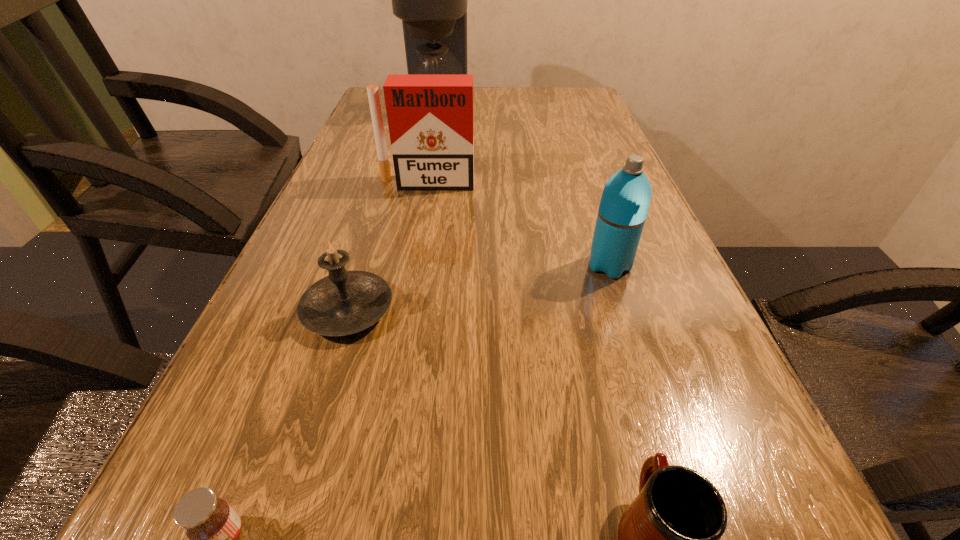
In order to click on coffee maker positioned at the left edge in this screenshot , I will do `click(431, 0)`.

What are the coordinates of `cigarette case located at the left edge` in the screenshot? It's located at (430, 116).

Identify the location of candle at the left edge. This screenshot has width=960, height=540. (345, 302).

In order to click on object located at the right edge in this screenshot , I will do `click(626, 197)`.

Identify the location of object that is at the far left corner. (431, 0).

The image size is (960, 540). I want to click on vacant area at the far edge of the desktop, so point(515,103).

This screenshot has width=960, height=540. In the image, there is a desktop. In order to click on vacant space at the left edge in this screenshot , I will do `click(211, 427)`.

This screenshot has width=960, height=540. Identify the location of free region at the right edge of the desktop. (651, 333).

Where is `free location at the far left corner of the desktop`? The width and height of the screenshot is (960, 540). free location at the far left corner of the desktop is located at coordinates (385, 100).

This screenshot has width=960, height=540. Identify the location of free region at the far right corner of the desktop. (547, 92).